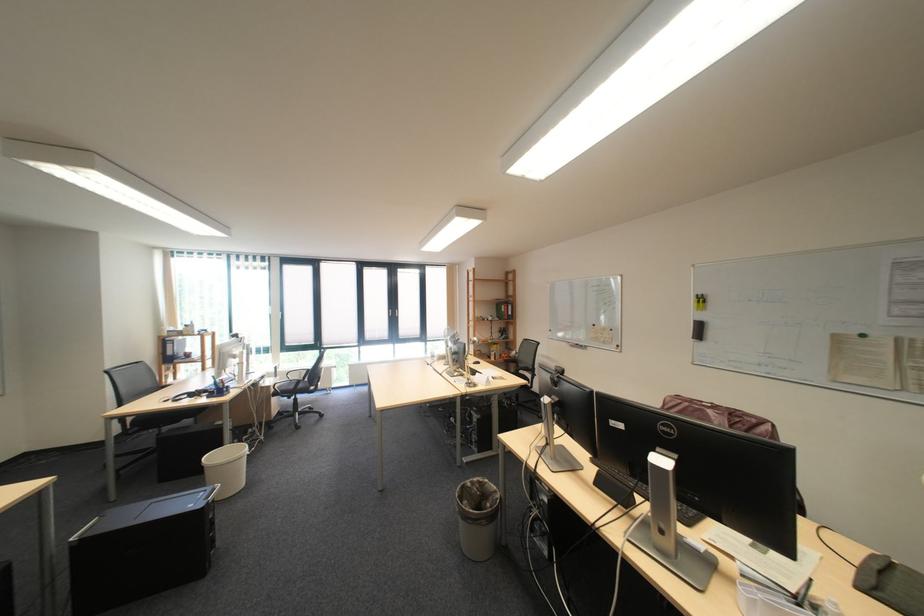
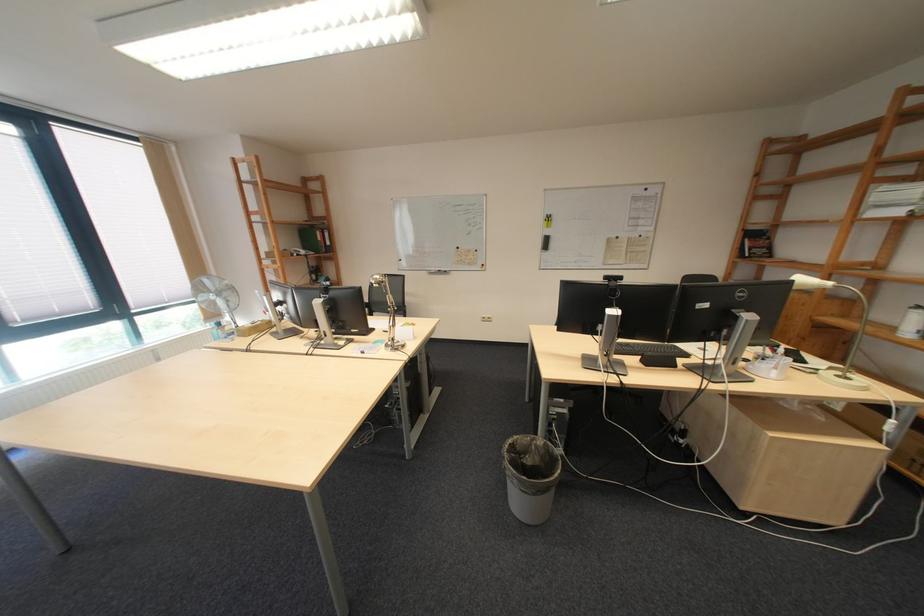
Locate, in the second image, the point that corresponds to (x=586, y=345) in the first image.

(446, 273)